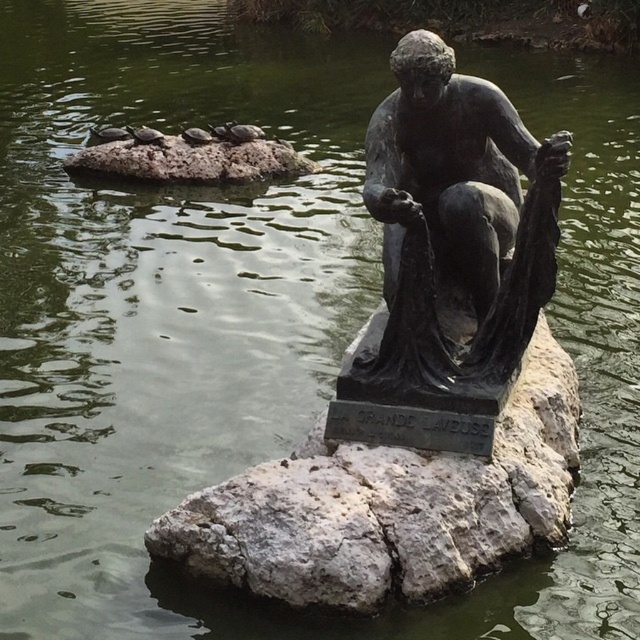
Question: Does bronze statue at center have a lesser width compared to gray rock at upper center?

Choices:
 (A) no
 (B) yes

Answer: (B)

Question: Is gray stone at center bigger than bronze statue at center?

Choices:
 (A) yes
 (B) no

Answer: (A)

Question: Among these objects, which one is farthest from the camera?

Choices:
 (A) gray stone at center
 (B) gray rock at upper center

Answer: (B)

Question: Is gray stone at center to the left of gray rock at upper center from the viewer's perspective?

Choices:
 (A) yes
 (B) no

Answer: (B)

Question: Which point appears closest to the camera in this image?

Choices:
 (A) (484, 81)
 (B) (173, 156)
 (C) (577, 449)

Answer: (A)

Question: Which point is closer to the camera?

Choices:
 (A) gray rock at upper center
 (B) bronze statue at center
 (C) gray stone at center

Answer: (C)